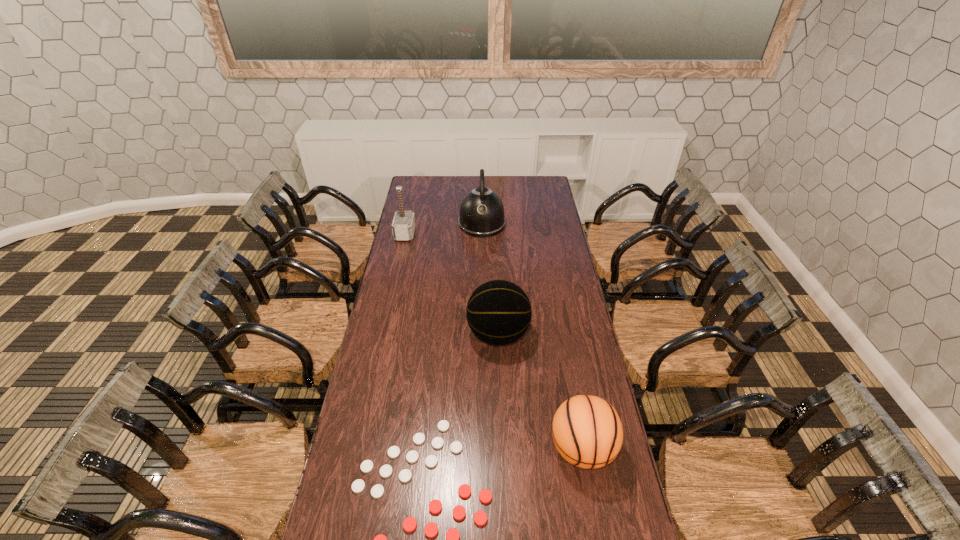
What are the coordinates of `vacant space that satisfies the following two spatial constraints: 1. on the spout of the left basketball; 2. on the left side of the kettle` in the screenshot? It's located at (483, 334).